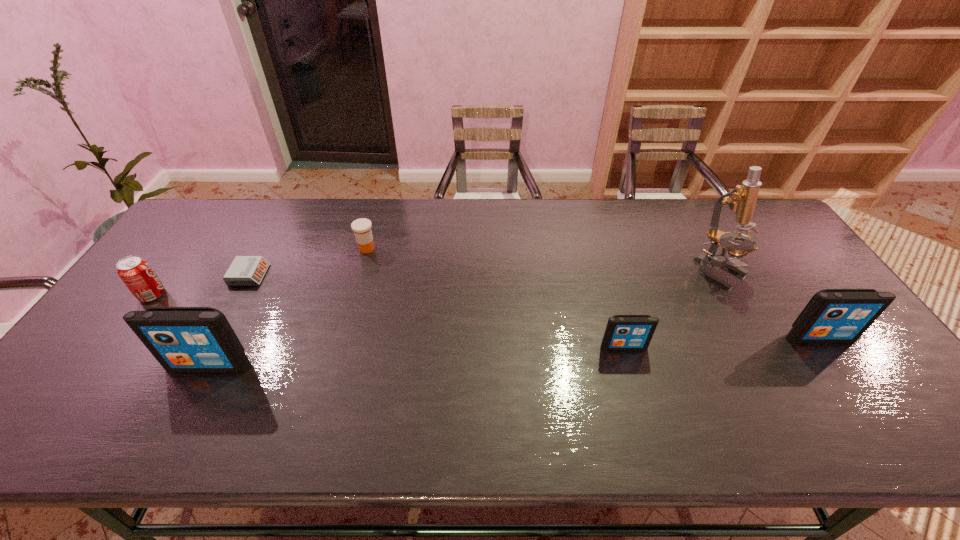
Where is `vacant area that lies between the farthest object and the nearest iPod`? The height and width of the screenshot is (540, 960). vacant area that lies between the farthest object and the nearest iPod is located at coordinates (288, 307).

Where is `free space between the farthest object and the nearest object`? This screenshot has width=960, height=540. free space between the farthest object and the nearest object is located at coordinates (288, 307).

Where is `free space that is in between the fifth object from left to right and the shortest object`? This screenshot has width=960, height=540. free space that is in between the fifth object from left to right and the shortest object is located at coordinates (437, 310).

In order to click on unoccupied position between the second iPod from left to right and the leftmost object in this screenshot , I will do `click(388, 321)`.

Locate an element on the screen. The width and height of the screenshot is (960, 540). free spot between the fifth shortest object and the shortest iPod is located at coordinates (722, 342).

You are a GUI agent. You are given a task and a screenshot of the screen. Output one action in this format:
    pyautogui.click(x=<x>, y=<y>)
    Task: Click on the object identified as the fifth closest to the nearest iPod
    The height and width of the screenshot is (540, 960).
    Given the screenshot: What is the action you would take?
    pyautogui.click(x=742, y=199)

Point out which object is positioned as the third nearest to the tallest object. Please provide its 2D coordinates. Your answer should be formatted as a tuple, i.e. [(x, y)], where the tuple contains the x and y coordinates of a point satisfying the conditions above.

[(362, 227)]

This screenshot has height=540, width=960. Find the location of `iPod identified as the second closest to the nearest iPod`. iPod identified as the second closest to the nearest iPod is located at coordinates (832, 315).

Identify which iPod is located as the third nearest to the alarm clock. Please provide its 2D coordinates. Your answer should be formatted as a tuple, i.e. [(x, y)], where the tuple contains the x and y coordinates of a point satisfying the conditions above.

[(832, 315)]

This screenshot has width=960, height=540. What are the coordinates of `free spot that satisfies the following two spatial constraints: 1. on the label of the medicine; 2. on the front screen of the nearest object` in the screenshot? It's located at (333, 365).